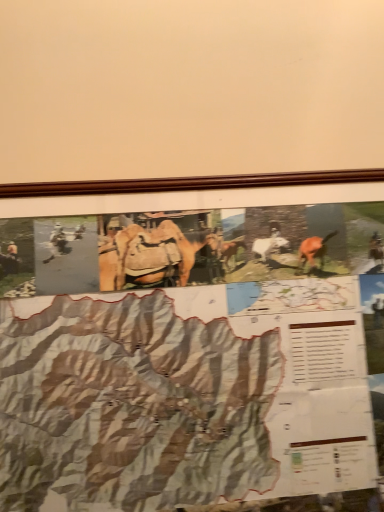
What do you see at coordinates (187, 342) in the screenshot? I see `wooden framed poster at center` at bounding box center [187, 342].

In order to click on wooden framed poster at center in this screenshot , I will do `click(187, 342)`.

You are a GUI agent. You are given a task and a screenshot of the screen. Output one action in this format:
    pyautogui.click(x=<x>, y=<y>)
    Task: Click on the wooden framed poster at center
    
    Given the screenshot: What is the action you would take?
    pyautogui.click(x=187, y=342)